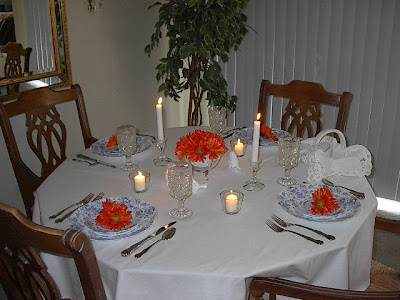
Locate an element on the screen. This screenshot has height=300, width=400. flower on plate is located at coordinates (115, 216), (112, 142), (200, 145), (270, 131), (324, 204).